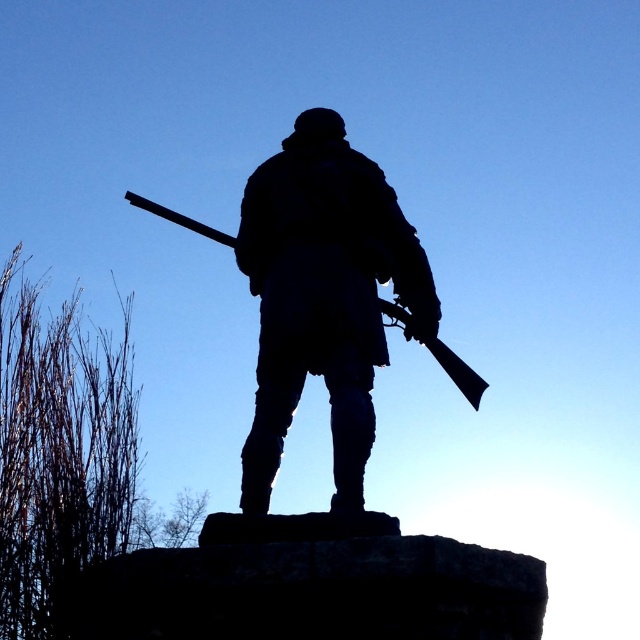
You are a photographer standing at a certain position wanting to capture the statue in the image. You have a drone that can fly up to 50 meters away. Can your drone reach the point where the statue is located, which is at point [353,168]?

The distance of point [353,168] from the camera is 51.62 meters, which is beyond the drone maximum range of 50 meters. The drone cannot reach the statue at point [353,168].

You are a photographer adjusting your camera settings to focus on two specific points in the image of the statue. The points are labeled as point 1 at coordinates point (372, 227) and point 2 at coordinates point (147, 208). Which point should you focus on first if you want to ensure the closest object is in sharp focus?

Point (372, 227) is closer to the camera than point (147, 208), so you should focus on point (372, 227) first to ensure the closest object is in sharp focus.

You are standing in the park and see the silhouette stone statue at center. If you walk directly towards the statue, will you first encounter the branches to the left of it or the statue itself?

You will first encounter the silhouette stone statue at center because it is located at the center point, while the branches are to the left of it.